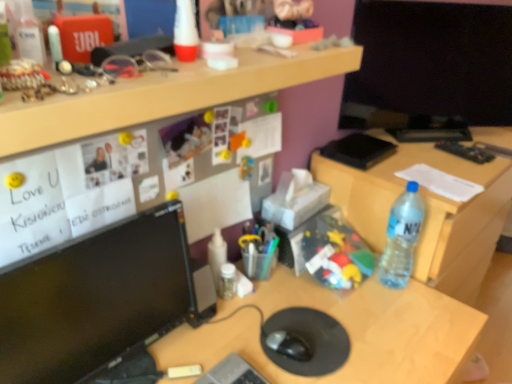
Question: Looking at the image, does black matte notepad at upper right seem bigger or smaller compared to matte black monitor at center, the 3th desk in the top-to-bottom sequence?

Choices:
 (A) big
 (B) small

Answer: (B)

Question: From the image's perspective, is black matte notepad at upper right positioned above or below matte black monitor at center, acting as the 1th desk starting from the bottom?

Choices:
 (A) below
 (B) above

Answer: (B)

Question: Which of these objects is positioned farthest from the translucent plastic bottle at center, which is the 1th bottle from left to right?

Choices:
 (A) translucent plastic toy at center, the 2th toy when ordered from front to back
 (B) black glossy monitor at left
 (C) clear plastic bottle at right, which is the 2th desk in top-to-bottom order
 (D) transparent plastic remote control at right
 (E) matte black monitor at center, acting as the 1th desk starting from the bottom

Answer: (D)

Question: Which is nearer to the transparent plastic remote control at right?

Choices:
 (A) translucent plastic bottle at center, which is the 2th bottle from right to left
 (B) clear plastic bottle at right, which is the 2th desk in top-to-bottom order
 (C) black glossy monitor at left
 (D) black matte mouse at center
 (E) wooden desk at upper center, arranged as the 1th desk when viewed from the top

Answer: (B)